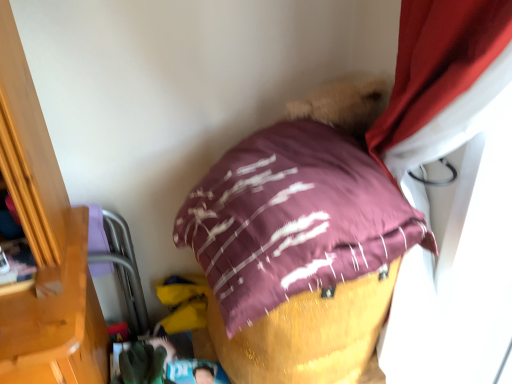
Question: Is purple fabric bean bag at left not within green fabric glove at lower center?

Choices:
 (A) no
 (B) yes

Answer: (B)

Question: Considering the relative sizes of purple fabric bean bag at left and green fabric glove at lower center in the image provided, is purple fabric bean bag at left taller than green fabric glove at lower center?

Choices:
 (A) no
 (B) yes

Answer: (B)

Question: Does purple fabric bean bag at left have a lesser height compared to green fabric glove at lower center?

Choices:
 (A) no
 (B) yes

Answer: (A)

Question: Is purple fabric bean bag at left aimed at green fabric glove at lower center?

Choices:
 (A) no
 (B) yes

Answer: (B)

Question: Can you confirm if purple fabric bean bag at left is bigger than green fabric glove at lower center?

Choices:
 (A) yes
 (B) no

Answer: (A)

Question: Considering the positions of point (129, 369) and point (370, 238), is point (129, 369) closer or farther from the camera than point (370, 238)?

Choices:
 (A) closer
 (B) farther

Answer: (B)

Question: From a real-world perspective, is green fabric glove at lower center physically located above or below maroon satin pillow at center?

Choices:
 (A) below
 (B) above

Answer: (A)

Question: Is green fabric glove at lower center inside the boundaries of maroon satin pillow at center, or outside?

Choices:
 (A) outside
 (B) inside

Answer: (A)

Question: Would you say green fabric glove at lower center is to the left or to the right of maroon satin pillow at center in the picture?

Choices:
 (A) right
 (B) left

Answer: (B)

Question: Considering their positions, is maroon satin pillow at center located in front of or behind purple fabric bean bag at left?

Choices:
 (A) front
 (B) behind

Answer: (A)

Question: Is maroon satin pillow at center spatially inside purple fabric bean bag at left, or outside of it?

Choices:
 (A) outside
 (B) inside

Answer: (A)

Question: Considering the relative positions of maroon satin pillow at center and purple fabric bean bag at left in the image provided, is maroon satin pillow at center to the left or to the right of purple fabric bean bag at left?

Choices:
 (A) left
 (B) right

Answer: (B)

Question: In terms of width, does maroon satin pillow at center look wider or thinner when compared to purple fabric bean bag at left?

Choices:
 (A) wide
 (B) thin

Answer: (A)

Question: Looking at their shapes, would you say purple fabric bean bag at left is wider or thinner than green fabric glove at lower center?

Choices:
 (A) wide
 (B) thin

Answer: (B)

Question: Would you say purple fabric bean bag at left is inside or outside green fabric glove at lower center?

Choices:
 (A) inside
 (B) outside

Answer: (B)